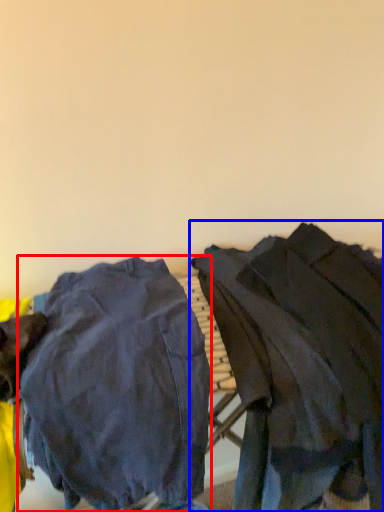
Question: Which of the following is the closest to the observer, tight (highlighted by a red box) or jacket (highlighted by a blue box)?

Choices:
 (A) tight
 (B) jacket

Answer: (A)